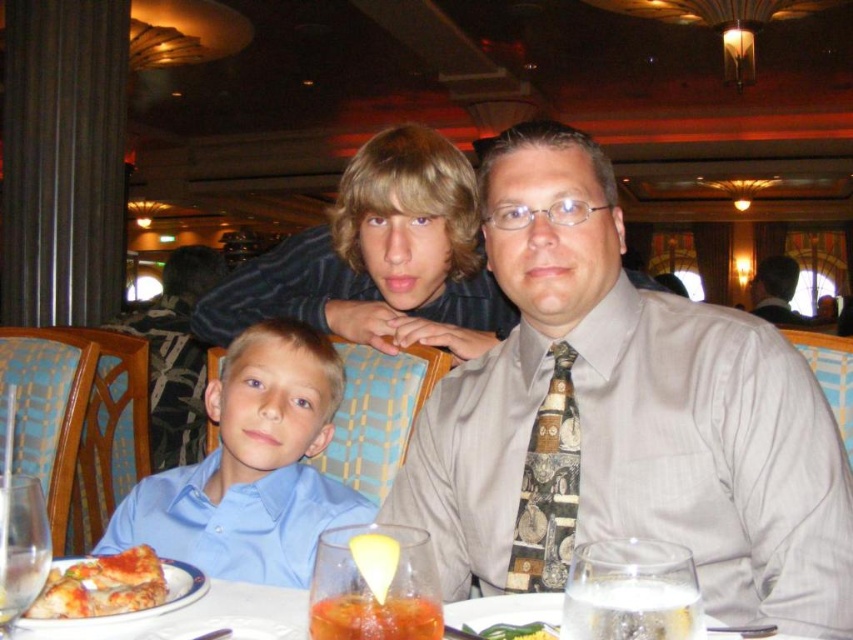
You are a photographer positioned at the center of the room. You want to capture a photo of the blue smooth shirt at lower left. Which direction should you move to get a better angle? The point coordinates are given in the format of x,y where the origin is at the bottom left corner of the image. The x increases to the right and y increases upward. The photographer is currently at the center of the image. The blue smooth shirt at lower left is located at point (251, 467). The photographer needs to move to

The blue smooth shirt at lower left is located at point (251, 467). Since the photographer is at the center of the image, they should move to the lower left direction to get a better angle. The coordinates indicate that the shirt is positioned towards the lower left quadrant of the image, so moving in that direction would bring the photographer closer to the subject.

Based on the photo, you are standing in front of the camera and want to grab the light brown leather jacket at upper right without moving your feet. Is it within your reach?

The light brown leather jacket at upper right is 16.29 feet away from the camera, so it is too far to reach without moving your feet.

You are a photographer trying to capture a closeup of the golden crispy pizza slice at lower left without including the blue smooth shirt at lower left in the frame. Given their sizes, is this possible?

The blue smooth shirt at lower left is bigger than the golden crispy pizza slice at lower left, so it might be challenging to frame the pizza slice without including the shirt due to its larger size.